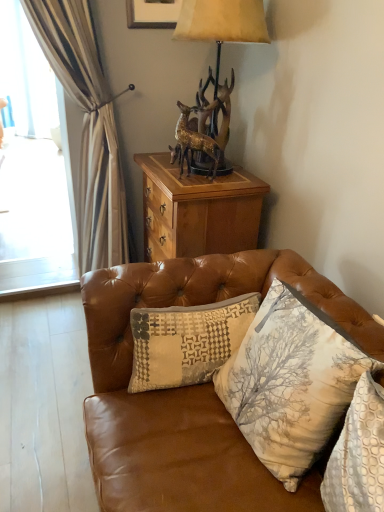
Where is `vacant area situated to the left side of gold metallic deer at center`? The width and height of the screenshot is (384, 512). vacant area situated to the left side of gold metallic deer at center is located at coordinates (168, 176).